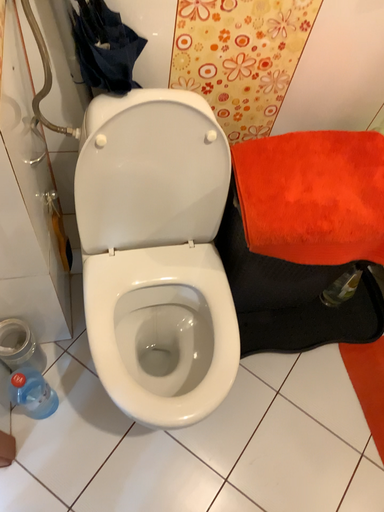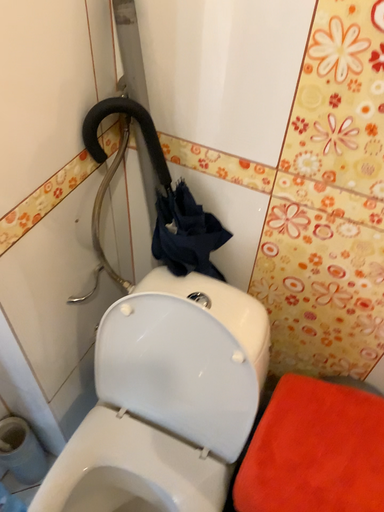
Question: How did the camera likely rotate when shooting the video?

Choices:
 (A) rotated left
 (B) rotated right

Answer: (A)